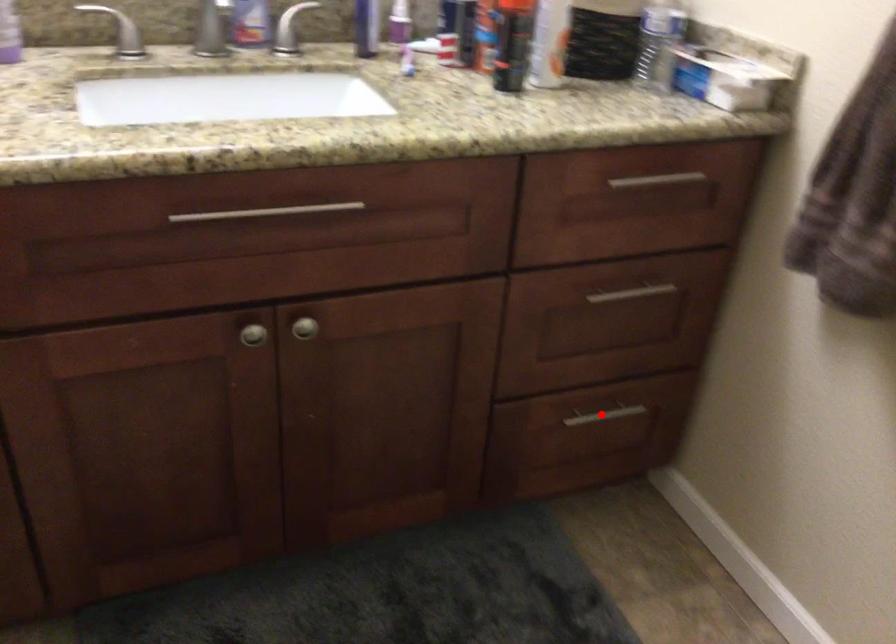
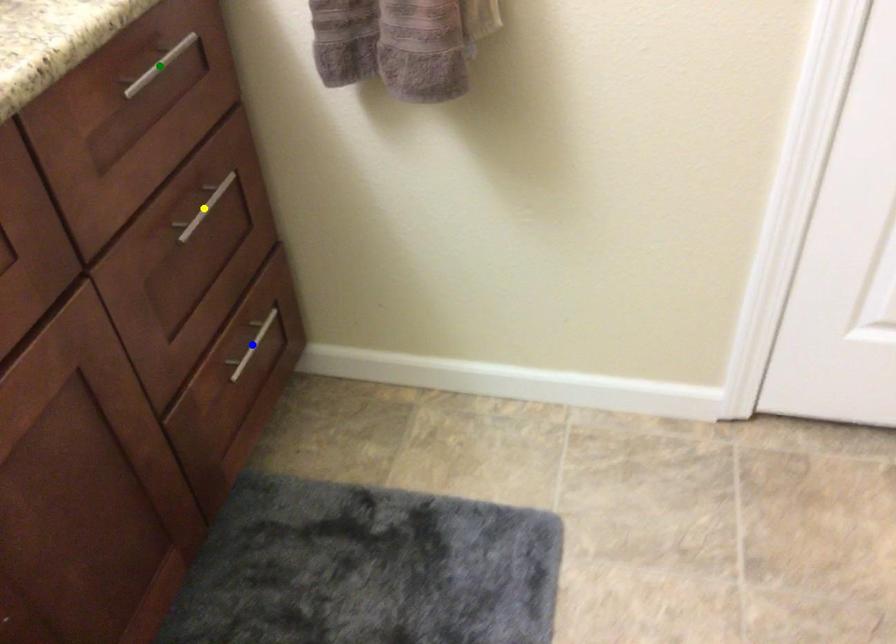
Question: I am providing you with two images of the same scene from different viewpoints. A red point is marked on the first image. You are given multiple points on the second image. Which mark in image 2 goes with the point in image 1?

Choices:
 (A) yellow point
 (B) blue point
 (C) green point

Answer: (B)